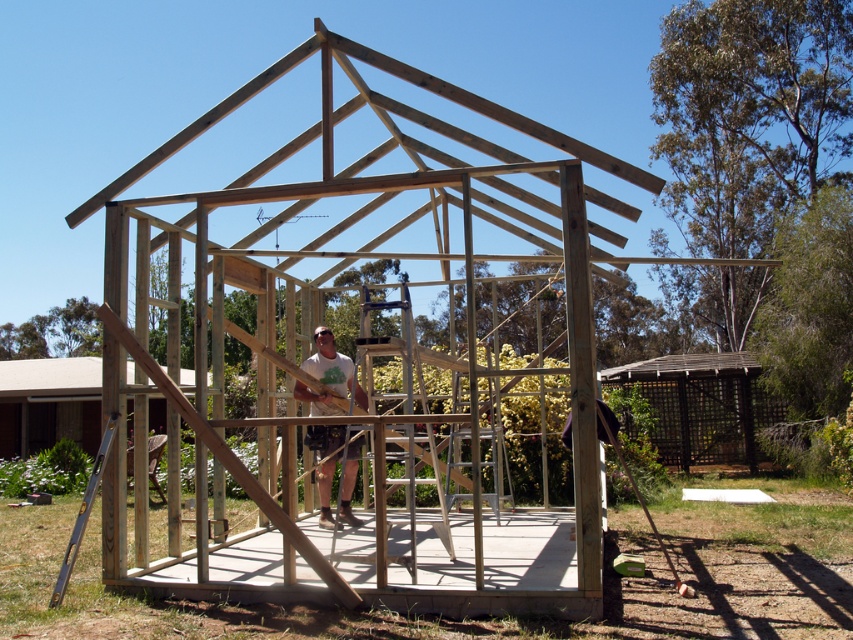
Question: Which of the following is the closest to the observer?

Choices:
 (A) (310, 188)
 (B) (180, 384)

Answer: (A)

Question: Based on their relative distances, which object is nearer to the wooden planks at center?

Choices:
 (A) brown woven hut at lower right
 (B) natural wood hut at center
 (C) natural wood frame at center

Answer: (A)

Question: Which point is farther from the camera taking this photo?

Choices:
 (A) (409, 262)
 (B) (154, 412)
 (C) (680, 449)
 (D) (332, 413)

Answer: (A)

Question: Does natural wood hut at center lie in front of wooden planks at center?

Choices:
 (A) yes
 (B) no

Answer: (A)

Question: Is natural wood frame at center above natural wood hut at center?

Choices:
 (A) yes
 (B) no

Answer: (A)

Question: Does brown woven hut at lower right have a smaller size compared to natural wood hut at center?

Choices:
 (A) no
 (B) yes

Answer: (B)